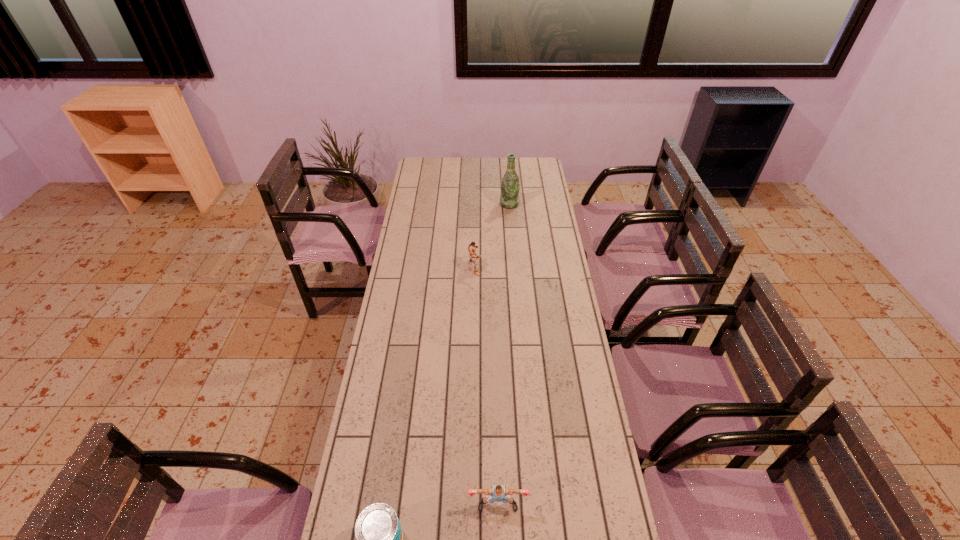
What are the coordinates of `the tallest object` in the screenshot? It's located at (510, 186).

Locate an element on the screen. Image resolution: width=960 pixels, height=540 pixels. the farthest object is located at coordinates (510, 186).

This screenshot has width=960, height=540. In order to click on the farther puncher in this screenshot , I will do `click(472, 247)`.

The image size is (960, 540). Find the location of `the nearer puncher`. the nearer puncher is located at coordinates (499, 493).

Identify the location of vacant region located 0.340m on the surface of the tallest object. This screenshot has width=960, height=540. (514, 253).

At what (x,y) coordinates should I click in order to perform the action: click on vacant space located 0.120m on the front-facing side of the farther puncher. Please return your answer as a coordinate pair (x, y). This screenshot has width=960, height=540. Looking at the image, I should click on (509, 267).

Find the location of a particular element. The height and width of the screenshot is (540, 960). vacant area situated 0.060m on the front-facing side of the nearer puncher is located at coordinates (498, 536).

Where is `free space at the far edge of the desktop`? The image size is (960, 540). free space at the far edge of the desktop is located at coordinates (450, 173).

You are a GUI agent. You are given a task and a screenshot of the screen. Output one action in this format:
    pyautogui.click(x=<x>, y=<y>)
    Task: Click on the free space at the left edge
    The height and width of the screenshot is (540, 960).
    Given the screenshot: What is the action you would take?
    pyautogui.click(x=385, y=349)

Locate an element on the screen. vacant space at the right edge of the desktop is located at coordinates (605, 519).